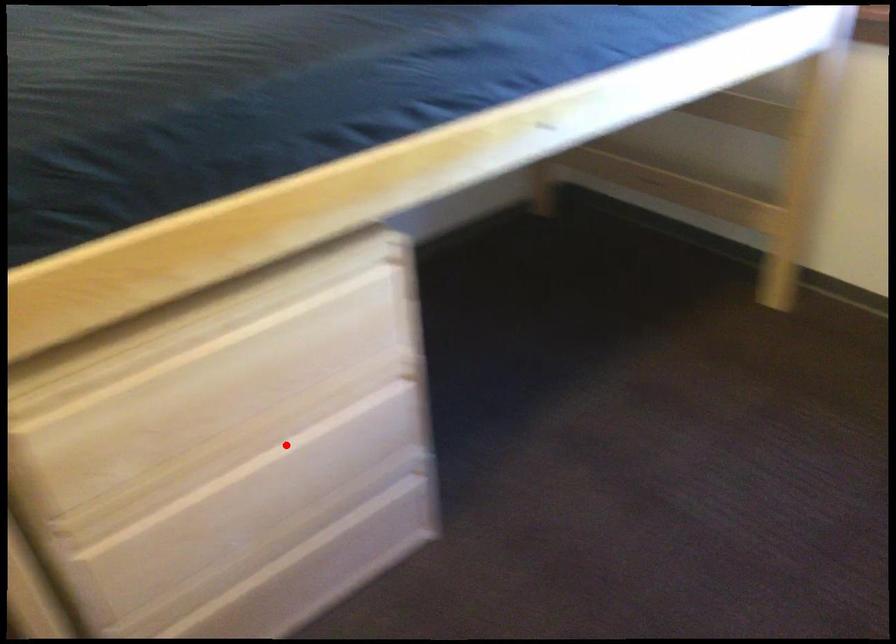
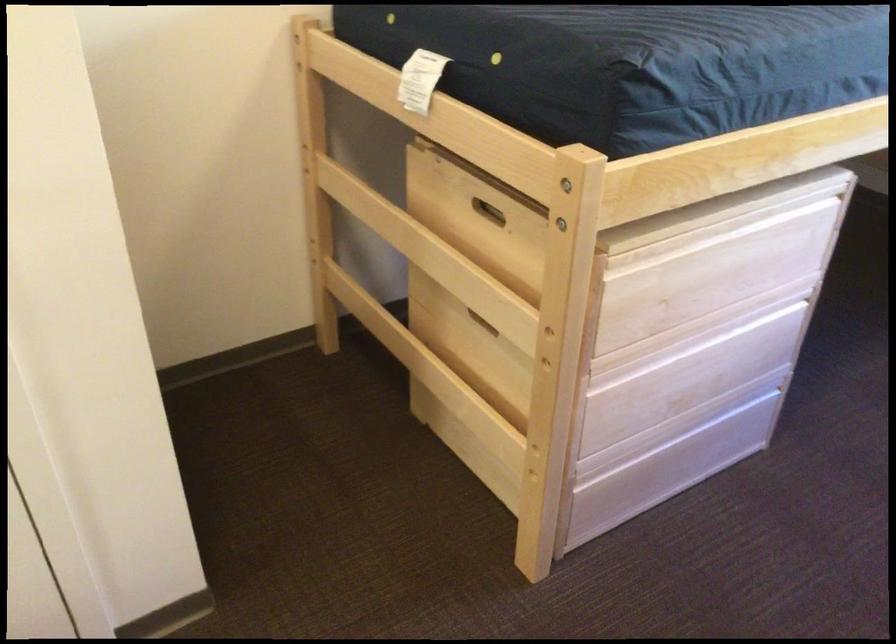
Question: I am providing you with two images of the same scene from different viewpoints. In image1, a red point is highlighted. Considering the same 3D point in image2, which of the following is correct?

Choices:
 (A) It is closer
 (B) It is farther

Answer: (B)